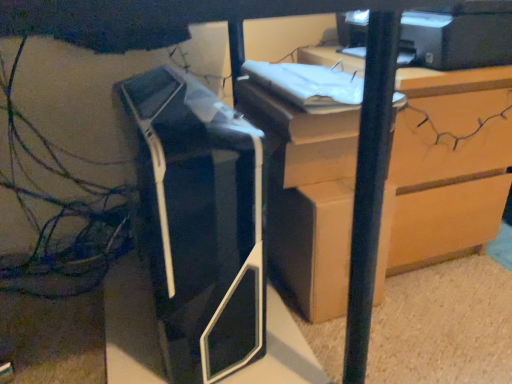
This screenshot has width=512, height=384. Find the location of `black plastic printer at center, arranged as the first printer when viewed from the left`. black plastic printer at center, arranged as the first printer when viewed from the left is located at coordinates (200, 223).

In order to face black plastic printer at center, the second printer when ordered from right to left, should I rotate leftwards or rightwards?

To face it directly, rotate left by 9.369 degrees.

The image size is (512, 384). What do you see at coordinates (446, 166) in the screenshot?
I see `wooden chest of drawers at upper right` at bounding box center [446, 166].

What do you see at coordinates (312, 245) in the screenshot? This screenshot has height=384, width=512. I see `matte cardboard box at center` at bounding box center [312, 245].

In order to click on black plastic printer at center, marked as the first printer in a bottom-to-top arrangement in this screenshot , I will do `click(200, 223)`.

Considering the relative sizes of matte black printer at upper right, which is the 1th printer from top to bottom, and matte cardboard box at center in the image provided, is matte black printer at upper right, which is the 1th printer from top to bottom, wider than matte cardboard box at center?

No, matte black printer at upper right, which is the 1th printer from top to bottom, is not wider than matte cardboard box at center.

Can you tell me how much matte black printer at upper right, which is the 1th printer from top to bottom, and matte cardboard box at center differ in facing direction?

There is a 1.54-degree angle between the facing directions of matte black printer at upper right, which is the 1th printer from top to bottom, and matte cardboard box at center.

From the matte cardboard box at center, count 1st printers forward and point to it. Please provide its 2D coordinates.

[(458, 36)]

Is wooden chest of drawers at upper right in front of or behind matte cardboard box at center in the image?

wooden chest of drawers at upper right is positioned farther from the viewer than matte cardboard box at center.

Does wooden chest of drawers at upper right touch matte cardboard box at center?

Indeed, wooden chest of drawers at upper right and matte cardboard box at center are beside each other and touching.

From the image's perspective, between wooden chest of drawers at upper right and matte cardboard box at center, who is located below?

matte cardboard box at center, from the image's perspective.

How different are the orientations of wooden chest of drawers at upper right and matte cardboard box at center in degrees?

wooden chest of drawers at upper right and matte cardboard box at center are facing 1.54 degrees away from each other.

Looking at the image, does matte cardboard box at center seem bigger or smaller compared to black plastic printer at center, marked as the first printer in a bottom-to-top arrangement?

In the image, matte cardboard box at center appears to be smaller than black plastic printer at center, marked as the first printer in a bottom-to-top arrangement.

Can you tell me how much matte cardboard box at center and black plastic printer at center, the second printer when ordered from right to left, differ in facing direction?

The angle between the facing direction of matte cardboard box at center and the facing direction of black plastic printer at center, the second printer when ordered from right to left, is 2.94 degrees.

Are matte cardboard box at center and black plastic printer at center, arranged as the first printer when viewed from the left, located far from each other?

They are positioned close to each other.

Measure the distance from matte cardboard box at center to black plastic printer at center, the second printer when ordered from right to left.

21.95 centimeters.

Which object is thinner, black plastic printer at center, arranged as the first printer when viewed from the left, or wooden chest of drawers at upper right?

With smaller width is wooden chest of drawers at upper right.

Is point (260, 159) farther from viewer compared to point (495, 133)?

No, (260, 159) is in front of (495, 133).

Who is taller, black plastic printer at center, arranged as the first printer when viewed from the left, or wooden chest of drawers at upper right?

With more height is wooden chest of drawers at upper right.

Is matte black printer at upper right, arranged as the 1th printer when viewed from the right, further to the viewer compared to black plastic printer at center, arranged as the first printer when viewed from the left?

Yes, it is behind black plastic printer at center, arranged as the first printer when viewed from the left.

What's the angular difference between matte black printer at upper right, which is the 1th printer from top to bottom, and black plastic printer at center, arranged as the 2th printer when viewed from the top,'s facing directions?

The angle between the facing direction of matte black printer at upper right, which is the 1th printer from top to bottom, and the facing direction of black plastic printer at center, arranged as the 2th printer when viewed from the top, is 1.4 degrees.

Is black plastic printer at center, marked as the first printer in a bottom-to-top arrangement, at the back of matte black printer at upper right, which is the 1th printer from top to bottom?

No, matte black printer at upper right, which is the 1th printer from top to bottom, is not facing the opposite direction of black plastic printer at center, marked as the first printer in a bottom-to-top arrangement.

Measure the distance from matte black printer at upper right, which is the 1th printer from top to bottom, to black plastic printer at center, arranged as the first printer when viewed from the left.

matte black printer at upper right, which is the 1th printer from top to bottom, is 21.46 inches away from black plastic printer at center, arranged as the first printer when viewed from the left.

Choose the correct answer: Is black plastic printer at center, arranged as the 2th printer when viewed from the top, inside matte black printer at upper right, marked as the second printer in a left-to-right arrangement, or outside it?

black plastic printer at center, arranged as the 2th printer when viewed from the top, is not inside matte black printer at upper right, marked as the second printer in a left-to-right arrangement, it's outside.

Which of these two, black plastic printer at center, the second printer when ordered from right to left, or matte black printer at upper right, the 2th printer positioned from the bottom, is smaller?

matte black printer at upper right, the 2th printer positioned from the bottom, is smaller.

From the image's perspective, relative to matte black printer at upper right, marked as the second printer in a left-to-right arrangement, is black plastic printer at center, the second printer when ordered from right to left, above or below?

Based on their image positions, black plastic printer at center, the second printer when ordered from right to left, is located beneath matte black printer at upper right, marked as the second printer in a left-to-right arrangement.

From a real-world perspective, between wooden chest of drawers at upper right and black plastic printer at center, arranged as the 2th printer when viewed from the top, who is vertically lower?

In real-world perspective, wooden chest of drawers at upper right is lower.

Is wooden chest of drawers at upper right smaller than black plastic printer at center, the second printer when ordered from right to left?

Incorrect, wooden chest of drawers at upper right is not smaller in size than black plastic printer at center, the second printer when ordered from right to left.

Considering the positions of points (335, 303) and (168, 179), is point (335, 303) farther from camera compared to point (168, 179)?

Yes.

You are a GUI agent. You are given a task and a screenshot of the screen. Output one action in this format:
    pyautogui.click(x=<x>, y=<y>)
    Task: Click on the cardboard box below the matte black printer at upper right, the 2th printer positioned from the bottom (from a real-world perspective)
    
    Given the screenshot: What is the action you would take?
    pyautogui.click(x=312, y=245)

Where is `the chest of drawers that is behind the matte cardboard box at center`? This screenshot has height=384, width=512. the chest of drawers that is behind the matte cardboard box at center is located at coordinates 446,166.

Looking at this image, based on their spatial positions, is wooden chest of drawers at upper right or black plastic printer at center, arranged as the 2th printer when viewed from the top, further from matte black printer at upper right, the 2th printer positioned from the bottom?

black plastic printer at center, arranged as the 2th printer when viewed from the top, is further to matte black printer at upper right, the 2th printer positioned from the bottom.

Based on their spatial positions, is matte cardboard box at center or matte black printer at upper right, marked as the second printer in a left-to-right arrangement, closer to wooden chest of drawers at upper right?

Result: Based on the image, matte cardboard box at center appears to be nearer to wooden chest of drawers at upper right.

Looking at the image, which one is located closer to matte cardboard box at center, black plastic printer at center, arranged as the first printer when viewed from the left, or matte black printer at upper right, marked as the second printer in a left-to-right arrangement?

Based on the image, black plastic printer at center, arranged as the first printer when viewed from the left, appears to be nearer to matte cardboard box at center.

When comparing their distances from black plastic printer at center, arranged as the 2th printer when viewed from the top, does matte black printer at upper right, marked as the second printer in a left-to-right arrangement, or matte cardboard box at center seem further?

matte black printer at upper right, marked as the second printer in a left-to-right arrangement, is positioned further to the anchor black plastic printer at center, arranged as the 2th printer when viewed from the top.

When comparing their distances from wooden chest of drawers at upper right, does matte black printer at upper right, the 2th printer positioned from the bottom, or black plastic printer at center, marked as the first printer in a bottom-to-top arrangement, seem closer?

matte black printer at upper right, the 2th printer positioned from the bottom.

When comparing their distances from black plastic printer at center, arranged as the first printer when viewed from the left, does wooden chest of drawers at upper right or matte black printer at upper right, arranged as the 1th printer when viewed from the right, seem further?

matte black printer at upper right, arranged as the 1th printer when viewed from the right, lies further to black plastic printer at center, arranged as the first printer when viewed from the left, than the other object.

When comparing their distances from matte cardboard box at center, does matte black printer at upper right, arranged as the 1th printer when viewed from the right, or wooden chest of drawers at upper right seem further?

Among the two, matte black printer at upper right, arranged as the 1th printer when viewed from the right, is located further to matte cardboard box at center.

Estimate the real-world distances between objects in this image. Which object is further from black plastic printer at center, marked as the first printer in a bottom-to-top arrangement, matte black printer at upper right, the 2th printer positioned from the bottom, or wooden chest of drawers at upper right?

The object further to black plastic printer at center, marked as the first printer in a bottom-to-top arrangement, is matte black printer at upper right, the 2th printer positioned from the bottom.

Where is `cardboard box between black plastic printer at center, arranged as the first printer when viewed from the left, and wooden chest of drawers at upper right`? This screenshot has height=384, width=512. cardboard box between black plastic printer at center, arranged as the first printer when viewed from the left, and wooden chest of drawers at upper right is located at coordinates (312, 245).

Locate an element on the screen. cardboard box between black plastic printer at center, the second printer when ordered from right to left, and matte black printer at upper right, arranged as the 1th printer when viewed from the right is located at coordinates coord(312,245).

This screenshot has height=384, width=512. What are the coordinates of `the chest of drawers that lies between matte black printer at upper right, the 2th printer positioned from the bottom, and matte cardboard box at center from top to bottom` in the screenshot? It's located at (446, 166).

Find the location of a particular element. This screenshot has height=384, width=512. chest of drawers between black plastic printer at center, arranged as the 2th printer when viewed from the top, and matte black printer at upper right, the 2th printer positioned from the bottom, from left to right is located at coordinates (446, 166).